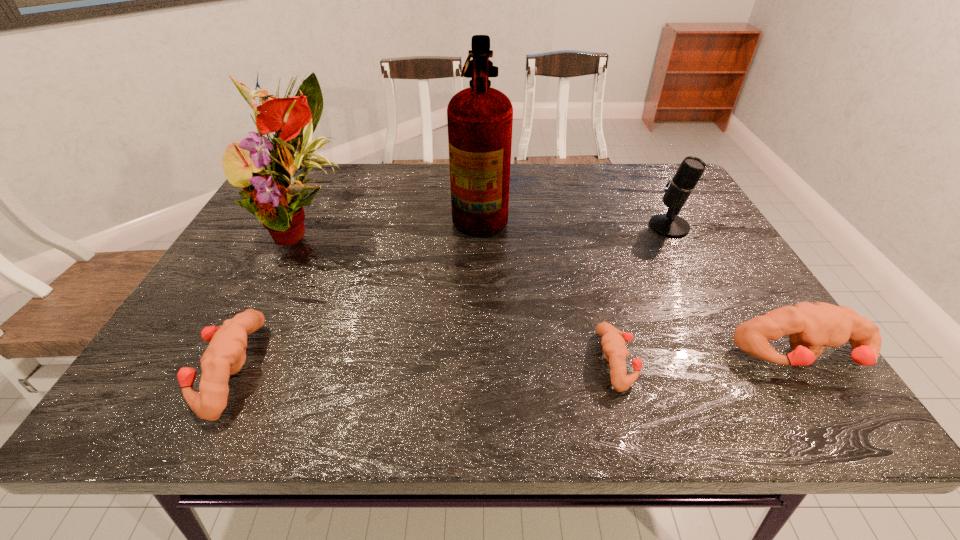
At what (x,y) coordinates should I click in order to perform the action: click on vacant area in the image that satisfies the following two spatial constraints: 1. on the front side of the microphone; 2. with the gloves of the leftmost puncher facing forward. Please return your answer as a coordinate pair (x, y). Looking at the image, I should click on (747, 369).

I want to click on free space that satisfies the following two spatial constraints: 1. at the nozzle of the fourth object from right to left; 2. on the front-facing side of the bouquet, so click(480, 227).

In order to click on vacant space that satisfies the following two spatial constraints: 1. with the gloves of the rightmost puncher facing forward; 2. with the gloves of the shortest puncher facing forward in this screenshot , I will do `click(806, 361)`.